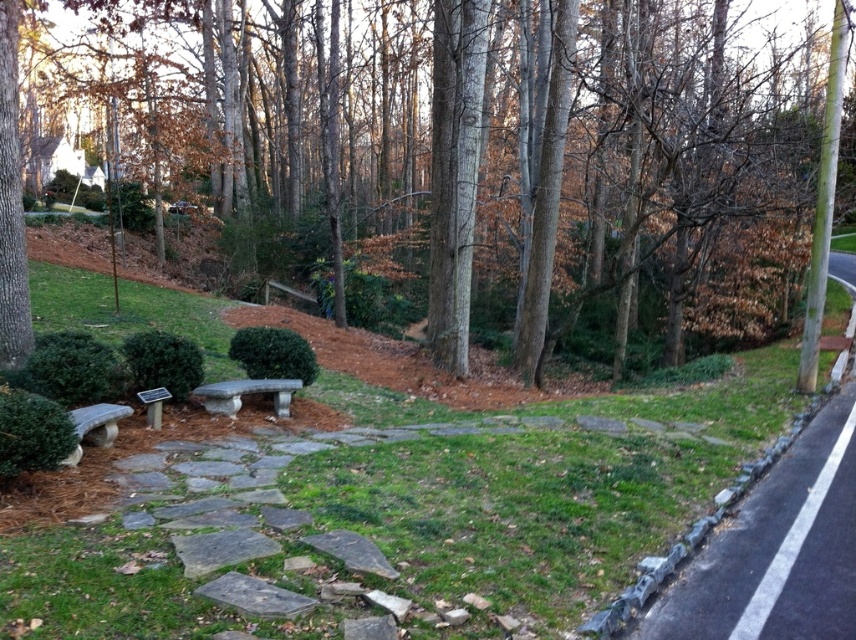
You are planning to plant a new tree in this outdoor area. The brown smooth tree at center has a trunk diameter of 30 cm. The gray concrete path at lower right is 40 cm wide. Can the new tree with a trunk diameter of 25 cm be placed between them without blocking the path?

The brown smooth tree at center has a trunk diameter of 30 cm and the gray concrete path at lower right is 40 cm wide. Since the new tree has a trunk diameter of 25 cm, which is smaller than both, it can be placed between them without blocking the path.

You are a gardener planning to plant a new flower bed between the brown smooth tree at center and the green grass at center. Which area has more space available for planting?

The brown smooth tree at center has a greater width than the green grass at center, so there is more space available for planting around the brown smooth tree at center.

In the scene shown: You are a gardener planning to plant a new flower bed between the brown smooth tree at center and the green grass at center. Which object should you place the flowers closer to?

The flowers should be placed closer to the green grass at center because the brown smooth tree at center is above the green grass at center, so the grass is lower and more suitable for planting.